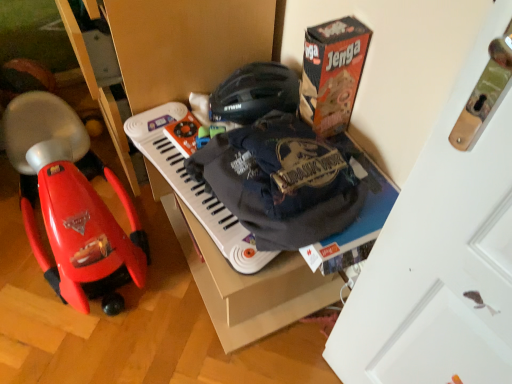
Question: Does white plastic musical keyboard at center appear on the left side of orange cardboard jenga box at upper right?

Choices:
 (A) no
 (B) yes

Answer: (B)

Question: Is white plastic musical keyboard at center bigger than orange cardboard jenga box at upper right?

Choices:
 (A) yes
 (B) no

Answer: (A)

Question: Considering the relative sizes of white plastic musical keyboard at center and orange cardboard jenga box at upper right in the image provided, is white plastic musical keyboard at center shorter than orange cardboard jenga box at upper right?

Choices:
 (A) yes
 (B) no

Answer: (A)

Question: Does white plastic musical keyboard at center lie in front of orange cardboard jenga box at upper right?

Choices:
 (A) no
 (B) yes

Answer: (A)

Question: From the image's perspective, would you say white plastic musical keyboard at center is positioned over orange cardboard jenga box at upper right?

Choices:
 (A) yes
 (B) no

Answer: (B)

Question: Does white plastic musical keyboard at center have a smaller size compared to orange cardboard jenga box at upper right?

Choices:
 (A) no
 (B) yes

Answer: (A)

Question: Does shiny red plastic baby carriage at left touch white matte door at upper right?

Choices:
 (A) yes
 (B) no

Answer: (B)

Question: Is shiny red plastic baby carriage at left completely or partially outside of white matte door at upper right?

Choices:
 (A) yes
 (B) no

Answer: (A)

Question: Can you confirm if shiny red plastic baby carriage at left is wider than white matte door at upper right?

Choices:
 (A) yes
 (B) no

Answer: (A)

Question: From the image's perspective, is shiny red plastic baby carriage at left on white matte door at upper right?

Choices:
 (A) no
 (B) yes

Answer: (B)

Question: From a real-world perspective, is shiny red plastic baby carriage at left physically below white matte door at upper right?

Choices:
 (A) yes
 (B) no

Answer: (A)

Question: Considering the relative sizes of shiny red plastic baby carriage at left and white matte door at upper right in the image provided, is shiny red plastic baby carriage at left taller than white matte door at upper right?

Choices:
 (A) no
 (B) yes

Answer: (A)

Question: Is white plastic musical keyboard at center to the right of shiny red plastic baby carriage at left from the viewer's perspective?

Choices:
 (A) no
 (B) yes

Answer: (B)